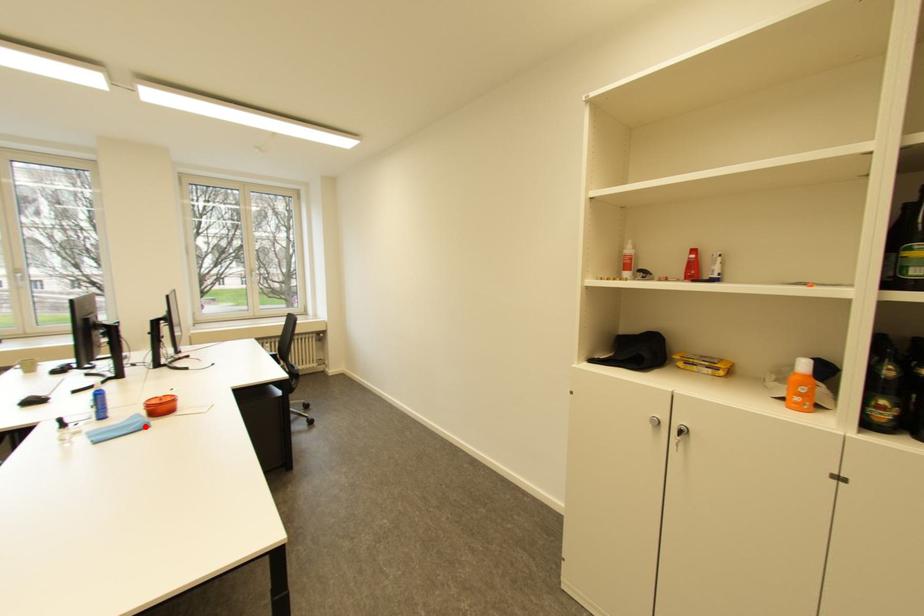
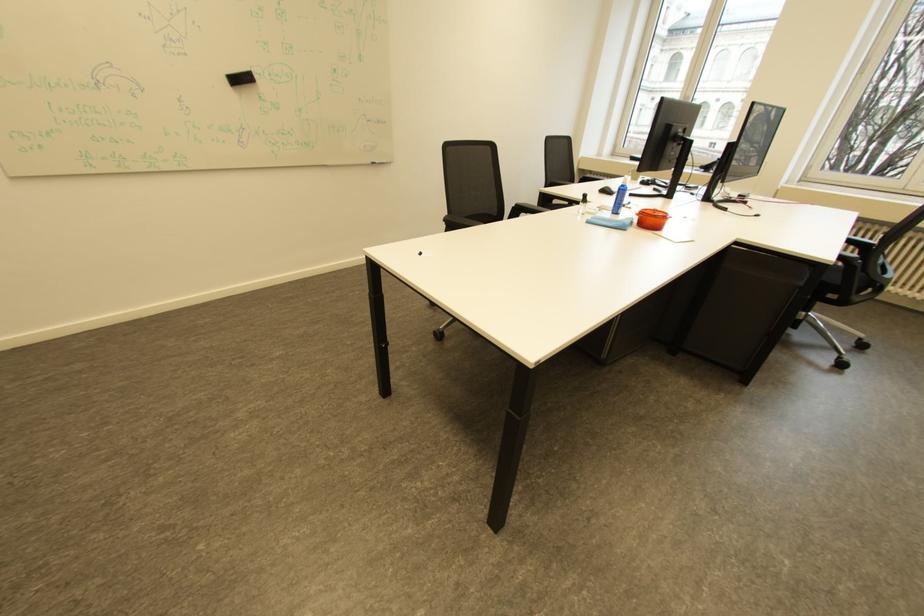
In the second image, find the point that corresponds to the highlighted location in the first image.

(627, 224)